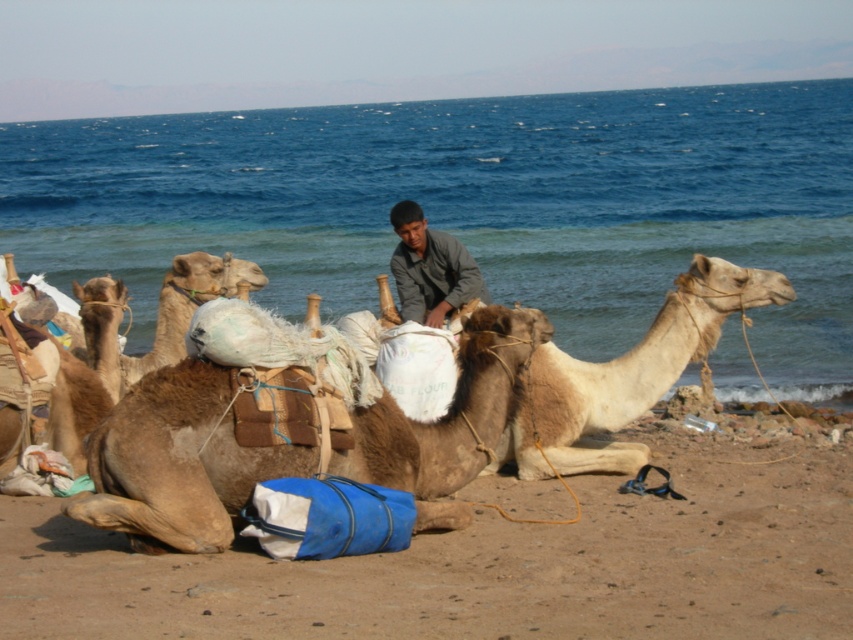
Question: Which point appears farthest from the camera in this image?

Choices:
 (A) click(666, 326)
 (B) click(587, 582)
 (C) click(413, 291)

Answer: (C)

Question: Can you confirm if brown rough camel at center is positioned above brown textured camel at center?

Choices:
 (A) no
 (B) yes

Answer: (A)

Question: Is brown sandy ground at lower center behind brown rough camel at center?

Choices:
 (A) yes
 (B) no

Answer: (B)

Question: Which is farther from the fuzzy beige camel at center?

Choices:
 (A) brown sandy ground at lower center
 (B) brown rough camel at center

Answer: (A)

Question: Which object is closer to the camera taking this photo?

Choices:
 (A) brown sandy ground at lower center
 (B) brown textured camel at center

Answer: (A)

Question: Does brown sandy ground at lower center appear on the right side of brown textured camel at center?

Choices:
 (A) yes
 (B) no

Answer: (A)